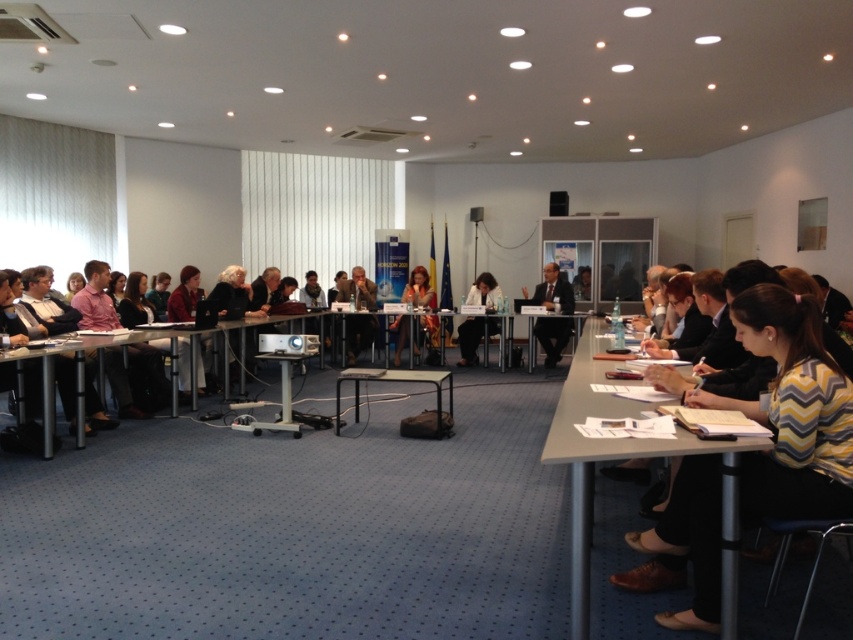
Question: Can you confirm if striped sweater at lower right is thinner than matte red jacket at center?

Choices:
 (A) yes
 (B) no

Answer: (B)

Question: Which of the following is the closest to the observer?

Choices:
 (A) (442, 417)
 (B) (848, 508)

Answer: (B)

Question: Which of the following is the closest to the observer?

Choices:
 (A) (357, 348)
 (B) (643, 448)
 (C) (538, 333)

Answer: (B)

Question: Is matte black laptop at center wider than white plastic table at center?

Choices:
 (A) no
 (B) yes

Answer: (A)

Question: Does white paper at center appear on the left side of matte black dress at center?

Choices:
 (A) yes
 (B) no

Answer: (B)

Question: Which point is farther to the camera?

Choices:
 (A) white plastic table at center
 (B) matte black laptop at center
 (C) white paper at center
 (D) matte black dress at center

Answer: (B)